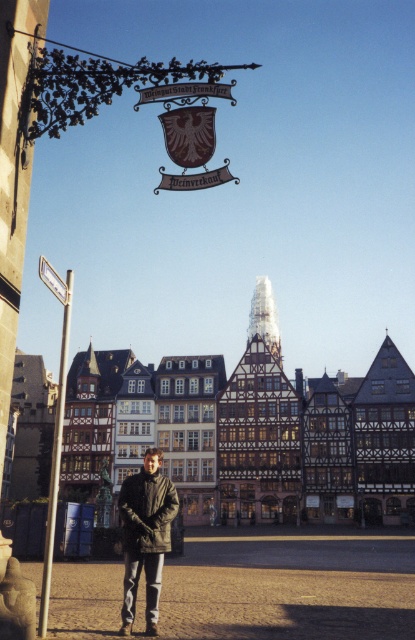
You are a tourist in the historic town square and notice two items in the scene. One is the dark gray jacket at center and the other is the silver metallic pole at left. Which of these two items is positioned to the right of the other?

The dark gray jacket at center is positioned to the right of the silver metallic pole at left.

You are a tourist in the historic town square and want to take a photo of the sign hanging above the buildings. You notice two points marked on your map at coordinates point [48,531] and point [61,294]. Which point should you stand at to ensure the sign is fully visible without any obstruction?

You should stand at point [48,531] because it is in front of point [61,294], so the sign will be visible without obstruction.

You are standing in the town square and want to find the silver metallic pole at left. According to the scene description, where should you look relative to the person in the foreground?

The silver metallic pole at left is located at point (55, 429), which means it is positioned to the left of the person in the foreground.